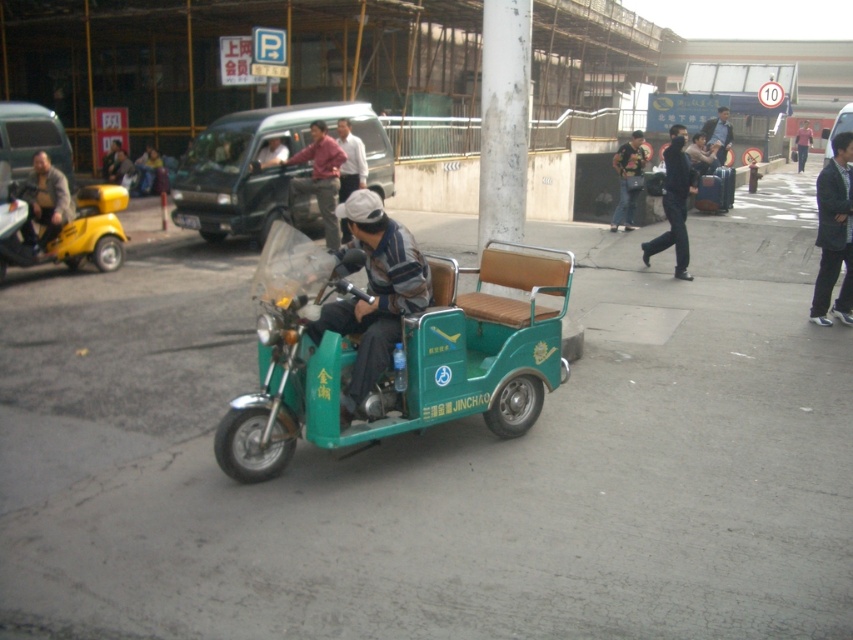
Between point (257, 198) and point (30, 141), which one is positioned in front?

Point (257, 198)

Does green matte van at center lie behind matte black scooter at left?

No, green matte van at center is closer to the viewer.

The width and height of the screenshot is (853, 640). In order to click on green matte van at center in this screenshot , I will do `click(262, 166)`.

This screenshot has height=640, width=853. Find the location of `green matte van at center`. green matte van at center is located at coordinates (262, 166).

Can you confirm if black fabric jacket at right is bigger than dark blue shirt at center?

Incorrect, black fabric jacket at right is not larger than dark blue shirt at center.

The height and width of the screenshot is (640, 853). Describe the element at coordinates (834, 232) in the screenshot. I see `black fabric jacket at right` at that location.

Is point (831, 212) in front of point (718, 124)?

Yes, point (831, 212) is in front of point (718, 124).

You are a GUI agent. You are given a task and a screenshot of the screen. Output one action in this format:
    pyautogui.click(x=<x>, y=<y>)
    Task: Click on the black fabric jacket at right
    
    Given the screenshot: What is the action you would take?
    pyautogui.click(x=834, y=232)

Who is shorter, matte black scooter at left or black smooth jacket at center?

With less height is black smooth jacket at center.

Does matte black scooter at left appear on the left side of black smooth jacket at center?

Correct, you'll find matte black scooter at left to the left of black smooth jacket at center.

Between point (64, 147) and point (676, 186), which one is positioned in front?

Point (676, 186) is more forward.

Locate an element on the screen. Image resolution: width=853 pixels, height=640 pixels. matte black scooter at left is located at coordinates (32, 138).